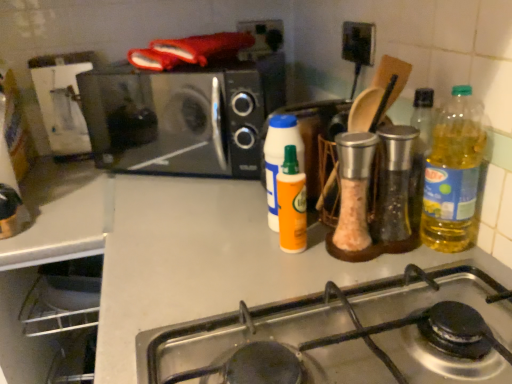
Question: Is black matte microwave at upper left shorter than orange matte bottle at center, which appears as the 4th bottle when viewed from the right?

Choices:
 (A) yes
 (B) no

Answer: (B)

Question: Considering the relative sizes of black matte microwave at upper left and orange matte bottle at center, which is the first bottle in left-to-right order, in the image provided, is black matte microwave at upper left smaller than orange matte bottle at center, which is the first bottle in left-to-right order,?

Choices:
 (A) yes
 (B) no

Answer: (B)

Question: Does black matte microwave at upper left have a larger size compared to orange matte bottle at center, which is the first bottle in left-to-right order?

Choices:
 (A) yes
 (B) no

Answer: (A)

Question: Is black matte microwave at upper left outside orange matte bottle at center, which is the first bottle in left-to-right order?

Choices:
 (A) yes
 (B) no

Answer: (A)

Question: Is the position of black matte microwave at upper left more distant than that of orange matte bottle at center, which appears as the 4th bottle when viewed from the right?

Choices:
 (A) yes
 (B) no

Answer: (A)

Question: Is black matte microwave at upper left positioned far away from orange matte bottle at center, which is the first bottle in left-to-right order?

Choices:
 (A) yes
 (B) no

Answer: (B)

Question: From a real-world perspective, is translucent glass oil at center right, placed as the third bottle when sorted from left to right, on stainless steel gas stove at lower center?

Choices:
 (A) no
 (B) yes

Answer: (B)

Question: From the image's perspective, is translucent glass oil at center right, placed as the third bottle when sorted from left to right, located beneath stainless steel gas stove at lower center?

Choices:
 (A) yes
 (B) no

Answer: (B)

Question: Considering the relative sizes of translucent glass oil at center right, placed as the third bottle when sorted from left to right, and stainless steel gas stove at lower center in the image provided, is translucent glass oil at center right, placed as the third bottle when sorted from left to right, taller than stainless steel gas stove at lower center?

Choices:
 (A) yes
 (B) no

Answer: (A)

Question: Is the depth of translucent glass oil at center right, placed as the third bottle when sorted from left to right, greater than that of stainless steel gas stove at lower center?

Choices:
 (A) no
 (B) yes

Answer: (B)

Question: Can you confirm if translucent glass oil at center right, placed as the third bottle when sorted from left to right, is shorter than stainless steel gas stove at lower center?

Choices:
 (A) no
 (B) yes

Answer: (A)

Question: Does translucent glass oil at center right, placed as the third bottle when sorted from left to right, turn towards stainless steel gas stove at lower center?

Choices:
 (A) no
 (B) yes

Answer: (A)

Question: Is yellow translucent bottle at right, the 1th bottle from the right, positioned behind stainless steel gas stove at lower center?

Choices:
 (A) no
 (B) yes

Answer: (B)